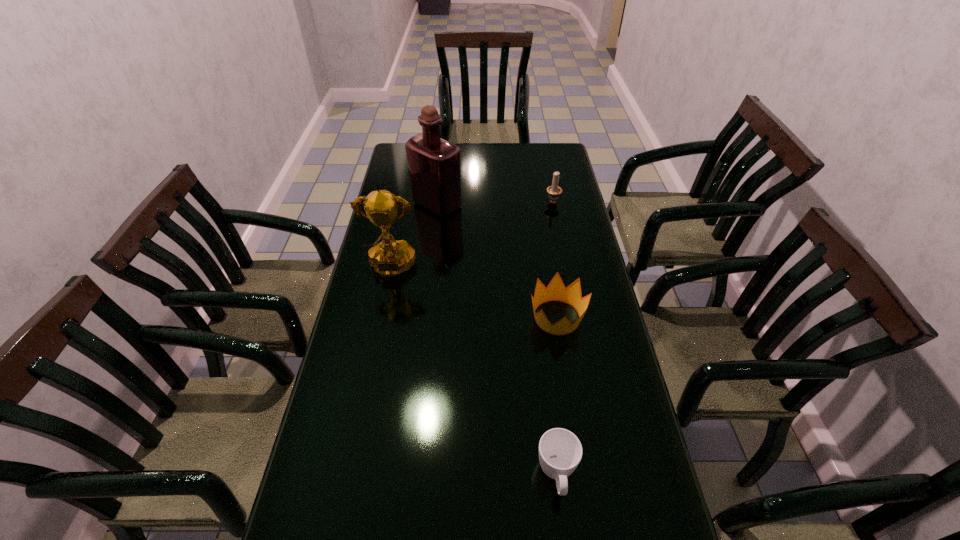
Where is `free location located 0.110m on the handle side of the candle_holder`? free location located 0.110m on the handle side of the candle_holder is located at coordinates (548, 180).

This screenshot has width=960, height=540. I want to click on blank space located on the front of the fourth farthest object, so click(x=580, y=462).

At what (x,y) coordinates should I click in order to perform the action: click on vacant space located with the handle on the side of the cup. Please return your answer as a coordinate pair (x, y). The width and height of the screenshot is (960, 540). Looking at the image, I should click on (564, 531).

Locate an element on the screen. The width and height of the screenshot is (960, 540). liquor that is at the left edge is located at coordinates (434, 164).

Where is `award present at the left edge`? award present at the left edge is located at coordinates (389, 258).

You are a GUI agent. You are given a task and a screenshot of the screen. Output one action in this format:
    pyautogui.click(x=<x>, y=<y>)
    Task: Click on the candle_holder present at the right edge
    This screenshot has height=540, width=960.
    Given the screenshot: What is the action you would take?
    pyautogui.click(x=554, y=191)

Locate an element on the screen. The image size is (960, 540). crown at the right edge is located at coordinates (556, 291).

Locate an element on the screen. free space at the far edge of the desktop is located at coordinates (464, 149).

Locate an element on the screen. free space at the left edge is located at coordinates (343, 353).

Image resolution: width=960 pixels, height=540 pixels. Find the location of `vacant area at the right edge of the desktop`. vacant area at the right edge of the desktop is located at coordinates (621, 377).